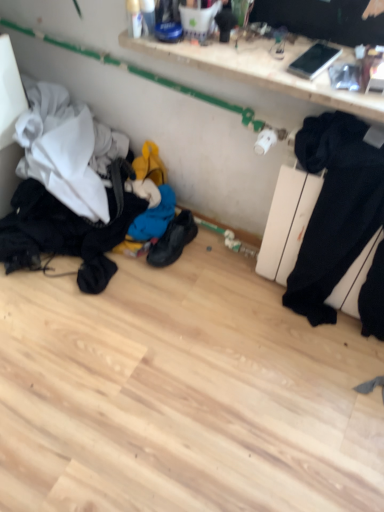
Image resolution: width=384 pixels, height=512 pixels. I want to click on free space to the left of black matte sweat pants at right, so click(234, 305).